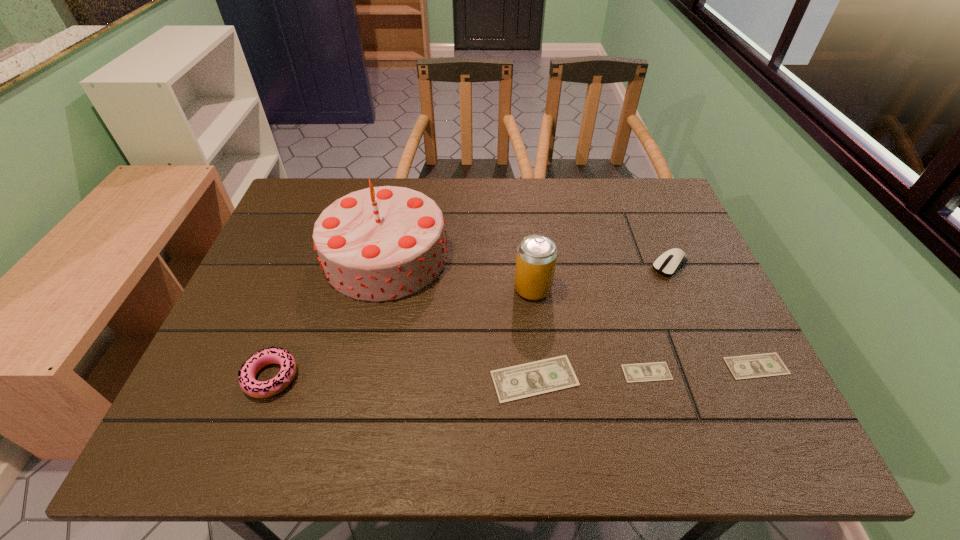
What are the coordinates of `the closest object relative to the pop (soda)` in the screenshot? It's located at (517, 382).

Point out which object is positioned as the sixth nearest to the sixth tallest object. Please provide its 2D coordinates. Your answer should be formatted as a tuple, i.e. [(x, y)], where the tuple contains the x and y coordinates of a point satisfying the conditions above.

[(258, 389)]

What are the coordinates of `the second closest money to the shortest object` in the screenshot? It's located at (769, 364).

Identify which money is the second nearest to the second money from left to right. Please provide its 2D coordinates. Your answer should be formatted as a tuple, i.e. [(x, y)], where the tuple contains the x and y coordinates of a point satisfying the conditions above.

[(769, 364)]

Locate an element on the screen. The width and height of the screenshot is (960, 540). free region that satisfies the following two spatial constraints: 1. on the back side of the doughnut; 2. on the left side of the mouse is located at coordinates (313, 265).

Where is `vacant space that satisfies the following two spatial constraints: 1. on the back side of the doughnut; 2. on the right side of the sixth shortest object`? This screenshot has height=540, width=960. vacant space that satisfies the following two spatial constraints: 1. on the back side of the doughnut; 2. on the right side of the sixth shortest object is located at coordinates (304, 288).

Image resolution: width=960 pixels, height=540 pixels. In order to click on vacant space that satisfies the following two spatial constraints: 1. on the front side of the tallest object; 2. on the right side of the tallest money in this screenshot , I will do pyautogui.click(x=359, y=379).